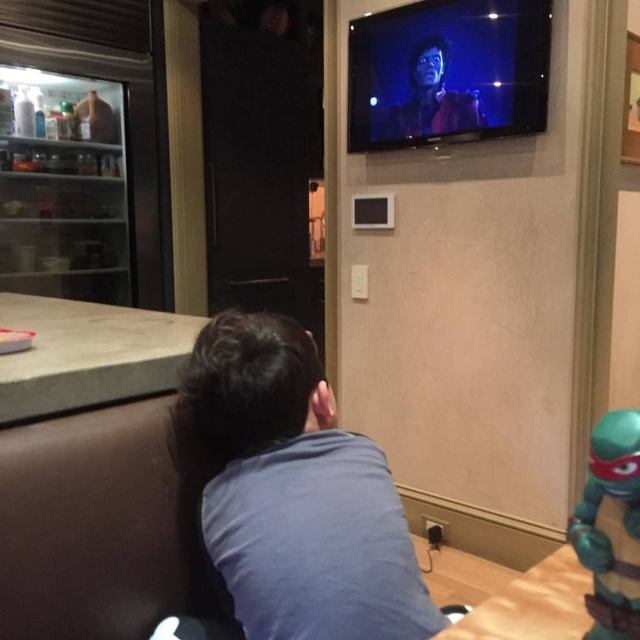
Question: Considering the real-world distances, which object is farthest from the teal plastic turtle at lower right?

Choices:
 (A) blue cotton shirt at center
 (B) shiny red leather jacket at upper center

Answer: (B)

Question: Which point is closer to the camera?

Choices:
 (A) shiny red leather jacket at upper center
 (B) blue cotton shirt at center
 (C) teal plastic turtle at lower right

Answer: (C)

Question: Can you confirm if teal plastic turtle at lower right is thinner than shiny red leather jacket at upper center?

Choices:
 (A) yes
 (B) no

Answer: (A)

Question: Which object is farther from the camera taking this photo?

Choices:
 (A) shiny red leather jacket at upper center
 (B) blue cotton shirt at center
 (C) teal plastic turtle at lower right

Answer: (A)

Question: Can you confirm if blue cotton shirt at center is wider than shiny red leather jacket at upper center?

Choices:
 (A) yes
 (B) no

Answer: (A)

Question: Does blue cotton shirt at center have a greater width compared to teal plastic turtle at lower right?

Choices:
 (A) yes
 (B) no

Answer: (A)